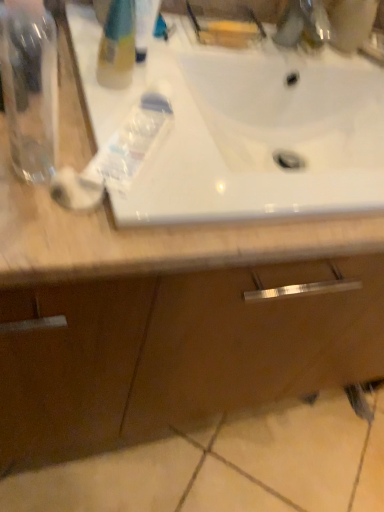
Where is `vacant area that is in front of translucent plastic toothpaste at center`? The width and height of the screenshot is (384, 512). vacant area that is in front of translucent plastic toothpaste at center is located at coordinates (101, 219).